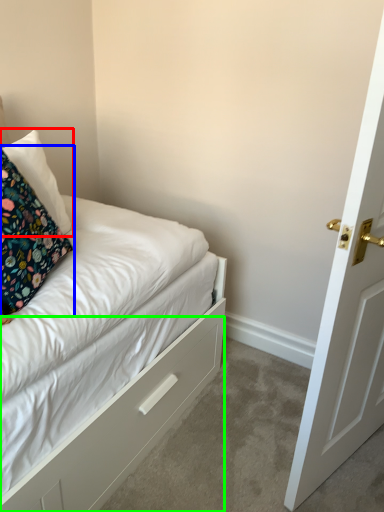
Question: Which is nearer to the pillow (highlighted by a red box)? pillow (highlighted by a blue box) or drawer (highlighted by a green box).

Choices:
 (A) pillow
 (B) drawer

Answer: (A)